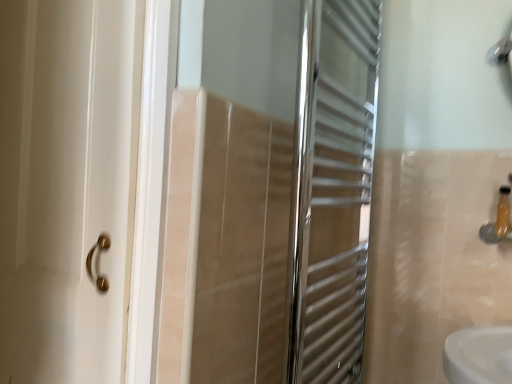
You are a GUI agent. You are given a task and a screenshot of the screen. Output one action in this format:
    pyautogui.click(x=<x>, y=<y>)
    Task: Click on the polished chrome towel rack at center
    
    Given the screenshot: What is the action you would take?
    pyautogui.click(x=277, y=194)

The image size is (512, 384). What do you see at coordinates (277, 194) in the screenshot?
I see `polished chrome towel rack at center` at bounding box center [277, 194].

Find the location of a particular element. The height and width of the screenshot is (384, 512). translucent plastic bottle at right is located at coordinates (503, 213).

The height and width of the screenshot is (384, 512). Describe the element at coordinates (503, 213) in the screenshot. I see `translucent plastic bottle at right` at that location.

Measure the distance between point (507, 221) and camera.

They are 3.80 feet apart.

What are the coordinates of `polished chrome towel rack at center` in the screenshot? It's located at (277, 194).

Considering the positions of objects polished chrome towel rack at center and translucent plastic bottle at right in the image provided, who is more to the right, polished chrome towel rack at center or translucent plastic bottle at right?

Positioned to the right is translucent plastic bottle at right.

Which object is further away from the camera, polished chrome towel rack at center or translucent plastic bottle at right?

Positioned behind is translucent plastic bottle at right.

Is point (245, 270) closer or farther from the camera than point (507, 233)?

Clearly, point (245, 270) is closer to the camera than point (507, 233).

From the image's perspective, between polished chrome towel rack at center and translucent plastic bottle at right, who is located below?

From the image's view, translucent plastic bottle at right is below.

From a real-world perspective, is polished chrome towel rack at center on top of translucent plastic bottle at right?

Yes.

Between polished chrome towel rack at center and translucent plastic bottle at right, which one has smaller width?

translucent plastic bottle at right.

Which of these two, polished chrome towel rack at center or translucent plastic bottle at right, stands taller?

polished chrome towel rack at center is taller.

Looking at the image, does polished chrome towel rack at center seem bigger or smaller compared to translucent plastic bottle at right?

polished chrome towel rack at center is bigger than translucent plastic bottle at right.

Is polished chrome towel rack at center inside the boundaries of translucent plastic bottle at right, or outside?

polished chrome towel rack at center is not enclosed by translucent plastic bottle at right.

Are polished chrome towel rack at center and translucent plastic bottle at right located far from each other?

polished chrome towel rack at center is near translucent plastic bottle at right, not far away.

Is polished chrome towel rack at center facing towards translucent plastic bottle at right?

No, polished chrome towel rack at center is not turned towards translucent plastic bottle at right.

How different are the orientations of polished chrome towel rack at center and translucent plastic bottle at right in degrees?

91.7 degrees separate the facing orientations of polished chrome towel rack at center and translucent plastic bottle at right.

Measure the distance between polished chrome towel rack at center and translucent plastic bottle at right.

polished chrome towel rack at center and translucent plastic bottle at right are 25.03 inches apart from each other.

Locate an element on the screen. screen door above the translucent plastic bottle at right (from a real-world perspective) is located at coordinates (277, 194).

Considering the positions of objects translucent plastic bottle at right and polished chrome towel rack at center in the image provided, who is more to the left, translucent plastic bottle at right or polished chrome towel rack at center?

Positioned to the left is polished chrome towel rack at center.

Between translucent plastic bottle at right and polished chrome towel rack at center, which one is positioned behind?

translucent plastic bottle at right.

Which is in front, point (504, 230) or point (329, 198)?

Positioned in front is point (504, 230).

From the image's perspective, which one is positioned lower, translucent plastic bottle at right or polished chrome towel rack at center?

translucent plastic bottle at right appears lower in the image.

From a real-world perspective, which is physically below, translucent plastic bottle at right or polished chrome towel rack at center?

translucent plastic bottle at right is physically lower.

Which object is wider, translucent plastic bottle at right or polished chrome towel rack at center?

polished chrome towel rack at center.

Does translucent plastic bottle at right have a lesser height compared to polished chrome towel rack at center?

Indeed, translucent plastic bottle at right has a lesser height compared to polished chrome towel rack at center.

Is translucent plastic bottle at right bigger than polished chrome towel rack at center?

No, translucent plastic bottle at right is not bigger than polished chrome towel rack at center.

Would you say polished chrome towel rack at center is part of translucent plastic bottle at right's contents?

Definitely not — polished chrome towel rack at center is not inside translucent plastic bottle at right.

Is translucent plastic bottle at right next to polished chrome towel rack at center and touching it?

translucent plastic bottle at right is not next to polished chrome towel rack at center, and they're not touching.

Is translucent plastic bottle at right facing away from polished chrome towel rack at center?

That's not correct — translucent plastic bottle at right is not looking away from polished chrome towel rack at center.

Can you tell me how much translucent plastic bottle at right and polished chrome towel rack at center differ in facing direction?

The angular difference between translucent plastic bottle at right and polished chrome towel rack at center is 91.7 degrees.

Identify the location of screen door above the translucent plastic bottle at right (from a real-world perspective). (277, 194).

Where is `screen door to the left of translucent plastic bottle at right`? screen door to the left of translucent plastic bottle at right is located at coordinates (277, 194).

In the image, there is a translucent plastic bottle at right. Find the location of `screen door above it (from the image's perspective)`. screen door above it (from the image's perspective) is located at coordinates (277, 194).